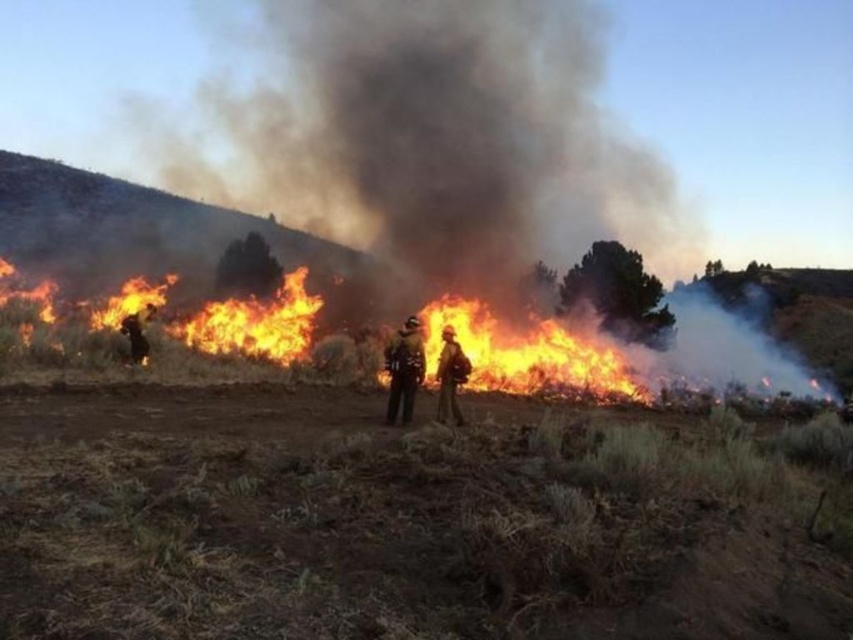
Question: Does orange flame helmet at center appear on the left side of dark brown uniform at left?

Choices:
 (A) yes
 (B) no

Answer: (B)

Question: Does black smoke at center lie in front of reflective silver helmet at center?

Choices:
 (A) no
 (B) yes

Answer: (A)

Question: Which object appears closest to the camera in this image?

Choices:
 (A) reflective silver helmet at center
 (B) bright orange flames at center
 (C) black smoke at center
 (D) dark brown uniform at left

Answer: (A)

Question: Which point is farther to the camera?

Choices:
 (A) (445, 344)
 (B) (397, 390)
 (C) (583, 364)
 (D) (140, 355)

Answer: (C)

Question: Can you confirm if bright orange flames at center is bigger than orange flame helmet at center?

Choices:
 (A) no
 (B) yes

Answer: (B)

Question: Which object appears closest to the camera in this image?

Choices:
 (A) black smoke at center
 (B) orange flame helmet at center

Answer: (B)